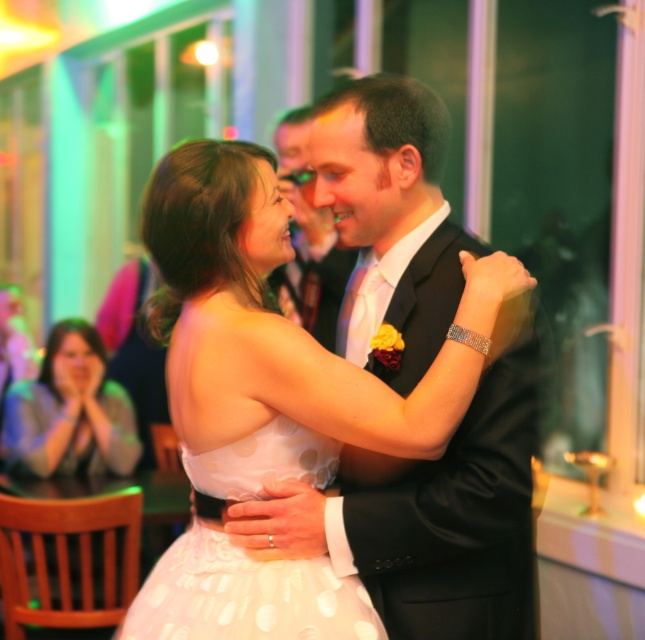
Question: Is white satin dress at center to the left of white dotted fabric dress at center from the viewer's perspective?

Choices:
 (A) yes
 (B) no

Answer: (B)

Question: Can you confirm if white satin dress at center is thinner than white dotted dress at lower left?

Choices:
 (A) yes
 (B) no

Answer: (B)

Question: Which point is farther to the camera?

Choices:
 (A) black satin suit at center
 (B) white satin dress at center
 (C) white dotted fabric dress at center

Answer: (A)

Question: Considering the real-world distances, which object is farthest from the white satin dress at center?

Choices:
 (A) white dotted fabric dress at center
 (B) black satin suit at center
 (C) white dotted dress at lower left

Answer: (C)

Question: Is white satin dress at center below white dotted dress at lower left?

Choices:
 (A) no
 (B) yes

Answer: (A)

Question: Which point is closer to the camera taking this photo?

Choices:
 (A) (70, 326)
 (B) (201, 636)
 (C) (284, 410)
 (D) (335, 291)

Answer: (B)